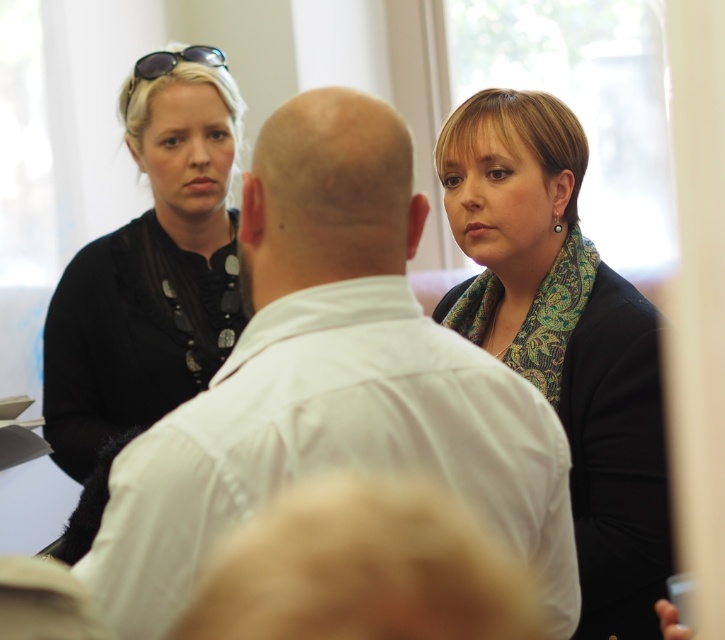
In the scene shown: You are standing in the room and want to locate the white matte shirt at center. Based on the coordinates provided, which direction should you look to find it?

The white matte shirt at center is located at coordinates point [331,380], so you should look towards the center of the room to find it.

You are standing in the room and want to move from point A to point B. Point A is at coordinate point (631, 397) and point B is at coordinate point (102, 380). Which point is closer to you when you first enter the room?

Point A at coordinate point (631, 397) is closer to the viewer than point B at coordinate point (102, 380).

You are a photographer trying to capture a candid shot of the white matte shirt at center and the sunglasses at upper left. Since you want both subjects in focus, which one should you adjust your camera focus to prioritize based on their positions?

The white matte shirt at center is closer to the viewer than the sunglasses at upper left. Therefore, to ensure both are in focus, you should set the focus on the white matte shirt at center first, as it is nearer, and the depth of field will naturally include the sunglasses at upper left in the background.